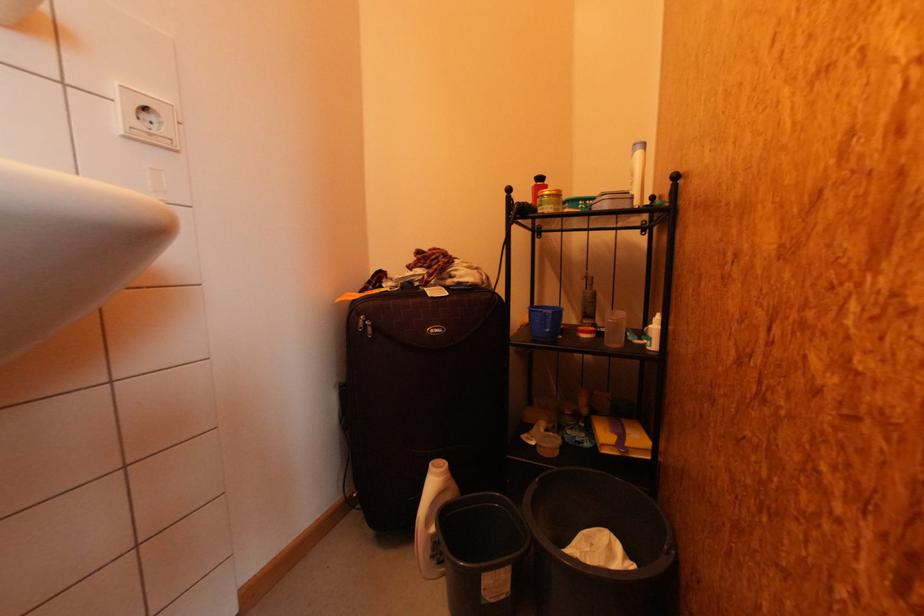
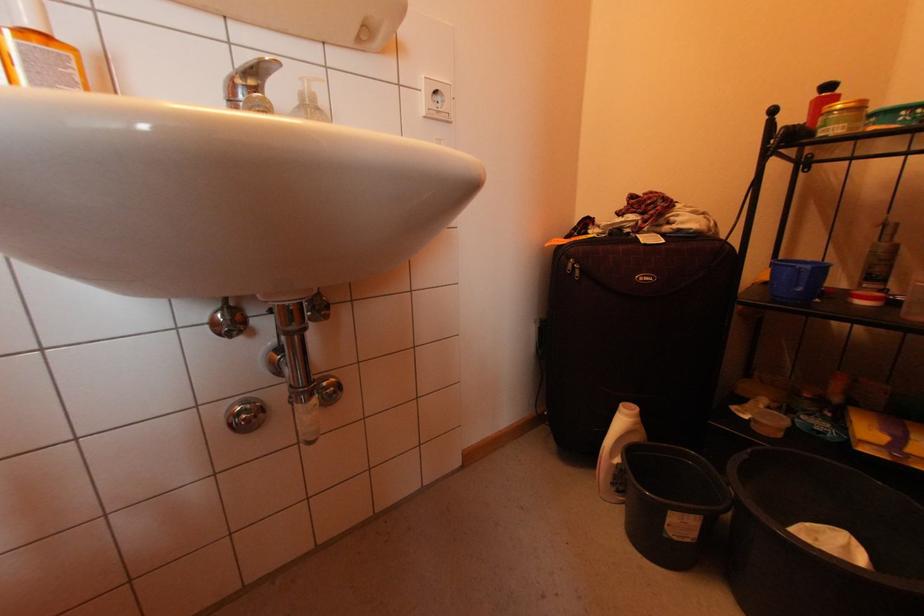
Find the pixel in the second image that matches point (551, 328) in the first image.

(803, 286)